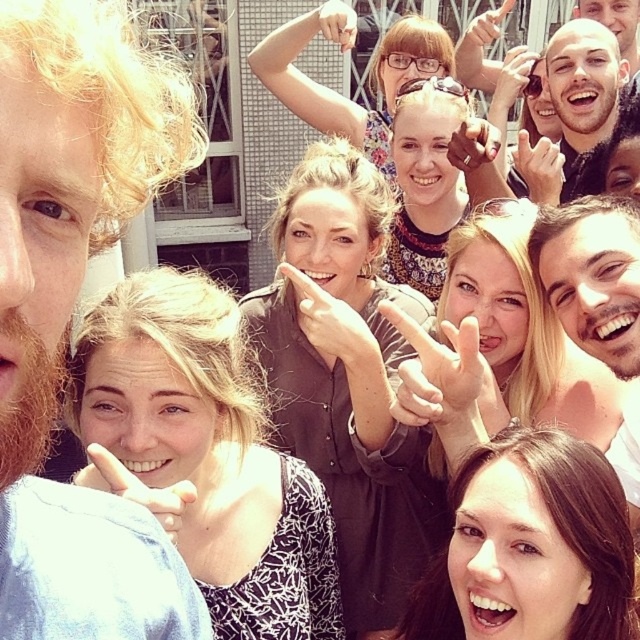
Which is more to the left, bearded man at left or smooth skin face at center?

From the viewer's perspective, bearded man at left appears more on the left side.

This screenshot has width=640, height=640. Describe the element at coordinates (72, 310) in the screenshot. I see `bearded man at left` at that location.

Is point (32, 1) positioned in front of point (620, 364)?

Yes, it is in front of point (620, 364).

What are the coordinates of `bearded man at left` in the screenshot? It's located at (72, 310).

Between smooth skin face at center and bald head at center, which one is positioned lower?

smooth skin face at center

Does smooth skin face at center appear over bald head at center?

Actually, smooth skin face at center is below bald head at center.

Find the location of `smooth skin face at center`. smooth skin face at center is located at coordinates (593, 275).

Image resolution: width=640 pixels, height=640 pixels. Identify the location of smooth skin face at center. (593, 275).

Does bearded man at left appear on the right side of bald head at center?

Incorrect, bearded man at left is not on the right side of bald head at center.

Is bearded man at left further to the viewer compared to bald head at center?

No, it is not.

From the picture: Who is more forward, (145, 541) or (620, 54)?

Point (145, 541) is in front.

Identify the location of bearded man at left. (72, 310).